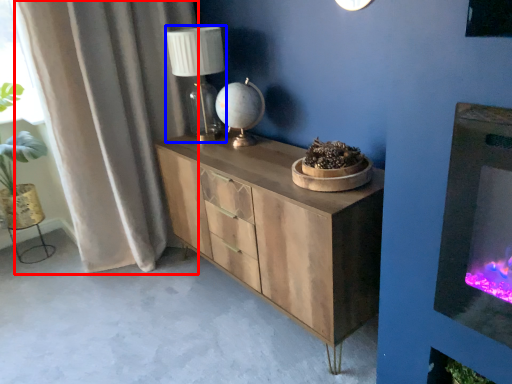
Question: Which object appears farthest to the camera in this image, curtain (highlighted by a red box) or table lamp (highlighted by a blue box)?

Choices:
 (A) curtain
 (B) table lamp

Answer: (B)